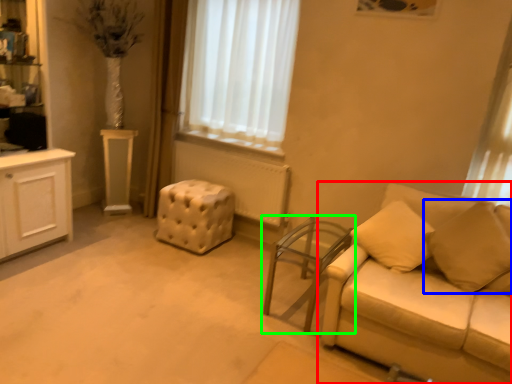
Question: Estimate the real-world distances between objects in this image. Which object is closer to studio couch (highlighted by a red box), pillow (highlighted by a blue box) or table (highlighted by a green box)?

Choices:
 (A) pillow
 (B) table

Answer: (A)